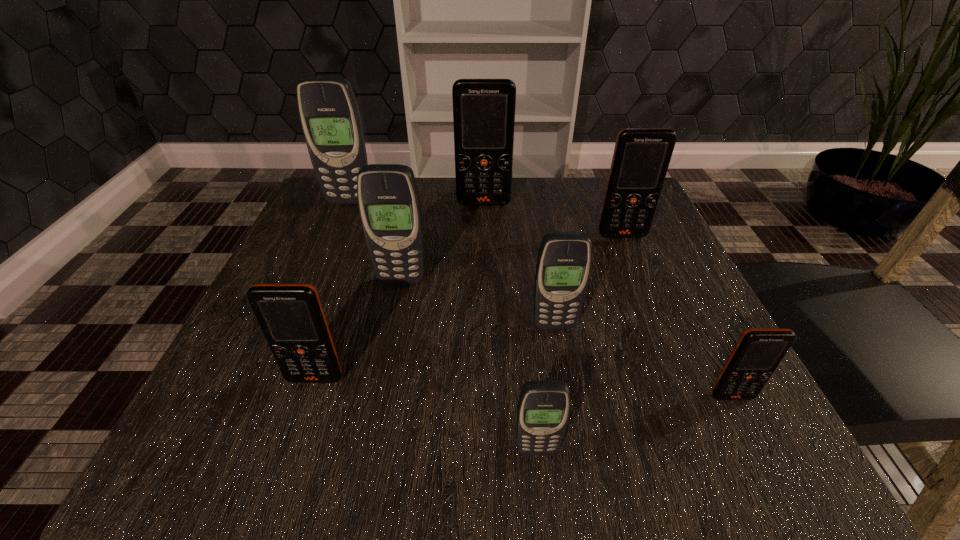
Where is `the third nearest object`? The width and height of the screenshot is (960, 540). the third nearest object is located at coordinates (291, 317).

Where is `the second smallest orange cellular telephone`? The width and height of the screenshot is (960, 540). the second smallest orange cellular telephone is located at coordinates (291, 317).

Find the location of a particular element. The height and width of the screenshot is (540, 960). the smallest orange cellular telephone is located at coordinates click(x=758, y=352).

In order to click on the seventh farthest object in this screenshot , I will do `click(758, 352)`.

Identify the location of the nearest object. (543, 410).

Find the location of a particular element. Image resolution: width=960 pixels, height=540 pixels. the nearest gray cellular telephone is located at coordinates (543, 410).

Find the location of a particular element. The width and height of the screenshot is (960, 540). vacant area located 0.200m on the screen of the second orange cellular telephone from left to right is located at coordinates (485, 264).

Find the location of a particular element. free location located 0.080m on the screen of the farthest gray cellular telephone is located at coordinates (339, 225).

Where is `vacant point located 0.260m on the screen of the sixth nearest object`? vacant point located 0.260m on the screen of the sixth nearest object is located at coordinates (664, 336).

The image size is (960, 540). Find the location of `vacant area situated 0.280m on the screen of the second biggest gray cellular telephone`. vacant area situated 0.280m on the screen of the second biggest gray cellular telephone is located at coordinates (372, 427).